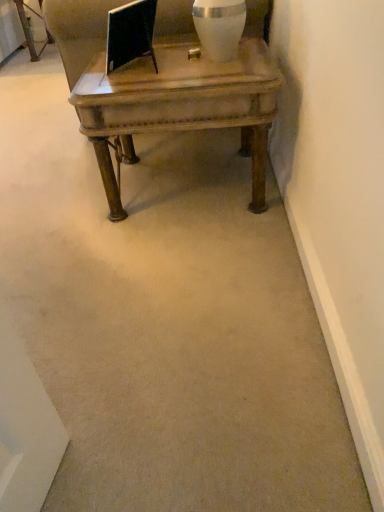
Where is `free space above wooden coffee table at center (from a real-world perspective)`? The height and width of the screenshot is (512, 384). free space above wooden coffee table at center (from a real-world perspective) is located at coordinates (166, 67).